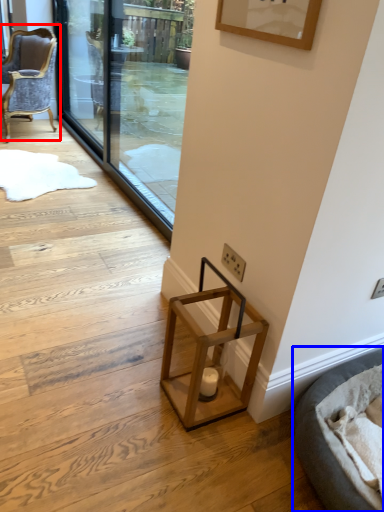
Question: Which object appears closest to the camera in this image, chair (highlighted by a red box) or cat bed (highlighted by a blue box)?

Choices:
 (A) chair
 (B) cat bed

Answer: (B)